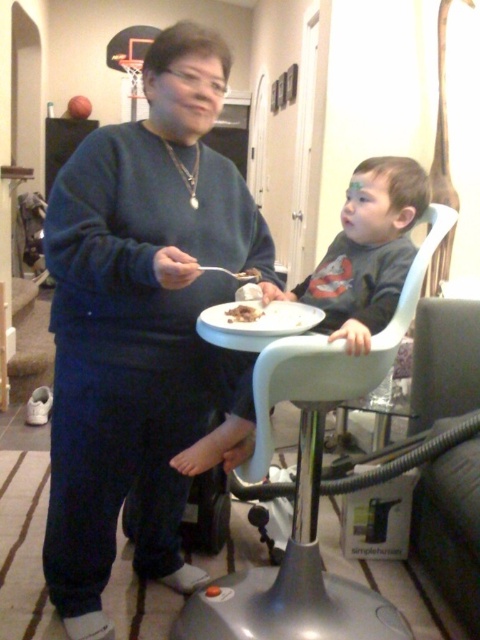
Is gray fabric swivel chair at center positioned in front of chocolate cake at center?

No, it is behind chocolate cake at center.

Who is more forward, (428,509) or (238,317)?

Point (238,317) is in front.

Does point (479, 627) come in front of point (254, 305)?

No.

Locate an element on the screen. The image size is (480, 640). gray fabric swivel chair at center is located at coordinates (452, 529).

Measure the distance between dark gray matte shirt at center and chocolate cake at center.

dark gray matte shirt at center and chocolate cake at center are 10.06 inches apart from each other.

Is dark gray matte shirt at center wider than chocolate cake at center?

Yes, dark gray matte shirt at center is wider than chocolate cake at center.

What do you see at coordinates (367, 252) in the screenshot? This screenshot has height=640, width=480. I see `dark gray matte shirt at center` at bounding box center [367, 252].

Locate an element on the screen. This screenshot has height=640, width=480. dark gray matte shirt at center is located at coordinates pyautogui.click(x=367, y=252).

Does white matte plate at center have a smaller size compared to chocolate cake at center?

Incorrect, white matte plate at center is not smaller in size than chocolate cake at center.

Who is lower down, white matte plate at center or chocolate cake at center?

Positioned lower is white matte plate at center.

Measure the distance between white matte plate at center and camera.

They are 4.05 feet apart.

Find the location of a particular element. The image size is (480, 640). white matte plate at center is located at coordinates (263, 317).